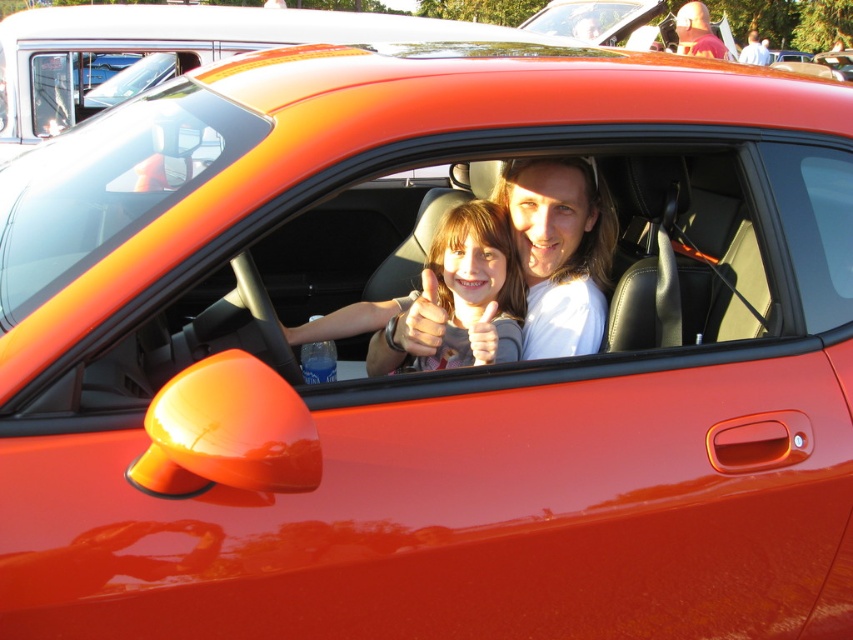
Question: Which of the following is the closest to the observer?

Choices:
 (A) matte white shirt at center
 (B) matte pink sweater at center

Answer: (B)

Question: Can you confirm if matte white shirt at center is positioned below matte pink sweater at center?

Choices:
 (A) yes
 (B) no

Answer: (B)

Question: Can you confirm if matte white shirt at center is positioned to the right of matte pink sweater at center?

Choices:
 (A) yes
 (B) no

Answer: (A)

Question: Does matte white shirt at center appear on the left side of matte pink sweater at center?

Choices:
 (A) yes
 (B) no

Answer: (B)